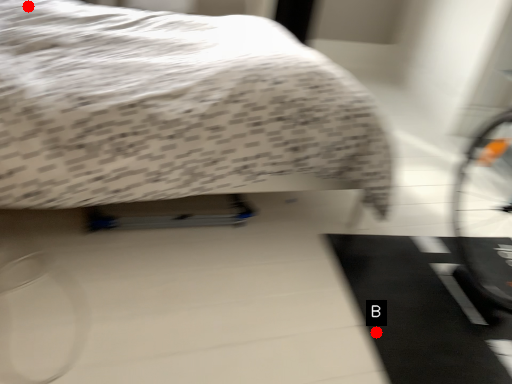
Question: Two points are circled on the image, labeled by A and B beside each circle. Which of the following is the farthest from the observer?

Choices:
 (A) A is further
 (B) B is further

Answer: (A)